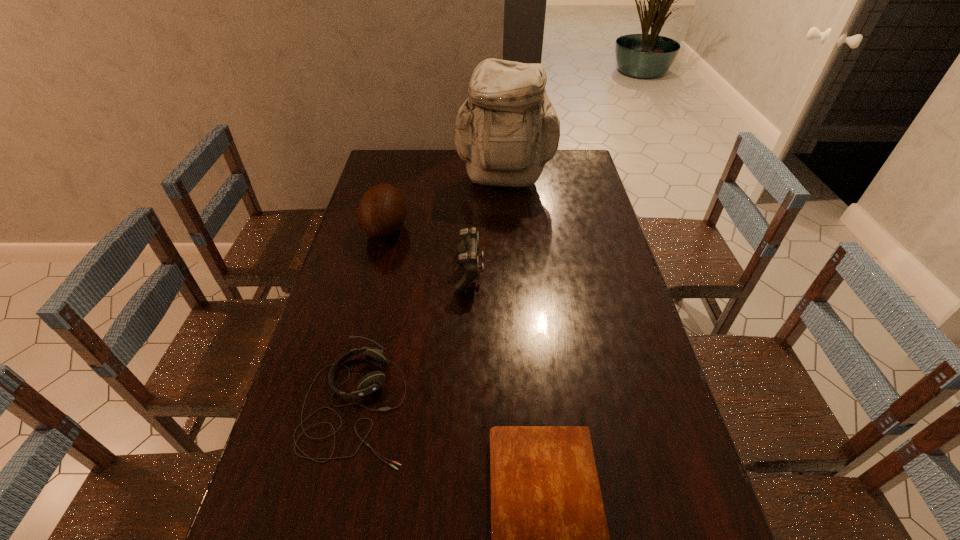
Find the location of a particular element. backpack is located at coordinates (507, 130).

Locate an element on the screen. The height and width of the screenshot is (540, 960). the tallest object is located at coordinates (507, 130).

Find the location of a particular element. the fourth shortest object is located at coordinates (381, 211).

Image resolution: width=960 pixels, height=540 pixels. What are the coordinates of `control` in the screenshot? It's located at (467, 251).

Where is `the second shortest object`? the second shortest object is located at coordinates (371, 382).

This screenshot has width=960, height=540. Identify the location of free space located 0.060m on the front-facing side of the backpack. (507, 211).

Locate an element on the screen. The height and width of the screenshot is (540, 960). free space located on the laces of the second tallest object is located at coordinates click(x=495, y=229).

Where is `vacant position located on the surface of the control with buttons`? This screenshot has width=960, height=540. vacant position located on the surface of the control with buttons is located at coordinates (518, 273).

You are a GUI agent. You are given a task and a screenshot of the screen. Output one action in this format:
    pyautogui.click(x=<x>, y=<y>)
    Task: Click on the free space located on the outer surface of the headset
    The height and width of the screenshot is (540, 960).
    Given the screenshot: What is the action you would take?
    pyautogui.click(x=538, y=405)

At what (x,y) coordinates should I click in order to perform the action: click on object that is at the far edge. Please return your answer as a coordinate pair (x, y). Image resolution: width=960 pixels, height=540 pixels. Looking at the image, I should click on (507, 130).